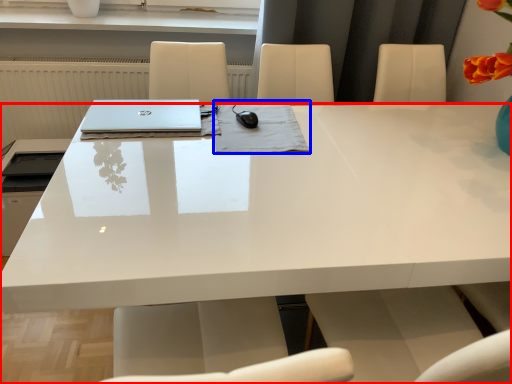
Question: Which point is closer to the camera, desk (highlighted by a red box) or notebook (highlighted by a blue box)?

Choices:
 (A) desk
 (B) notebook

Answer: (A)